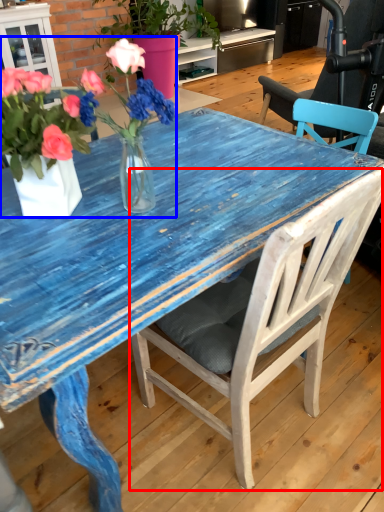
Question: Which object is closer to the camera taking this photo, chair (highlighted by a red box) or floral arrangement (highlighted by a blue box)?

Choices:
 (A) chair
 (B) floral arrangement

Answer: (A)